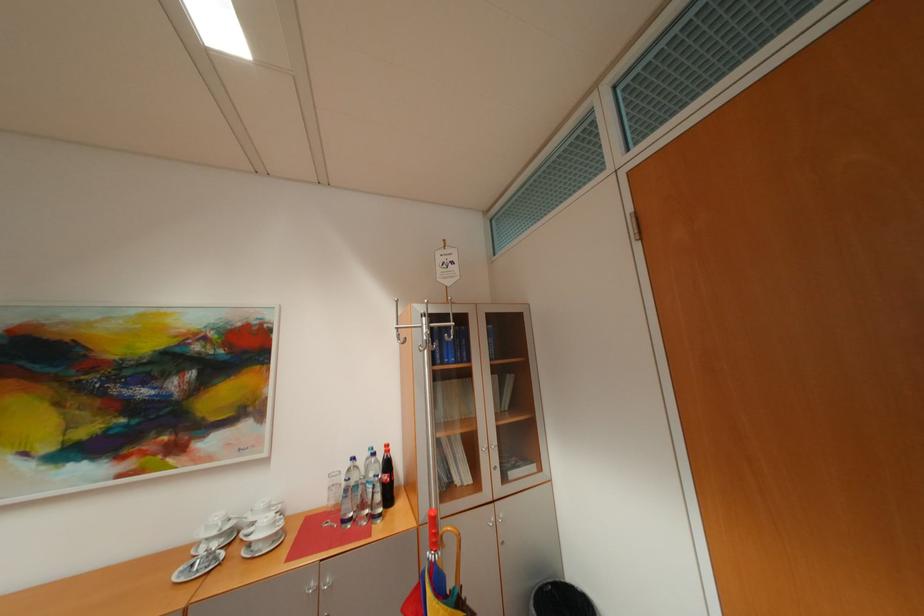
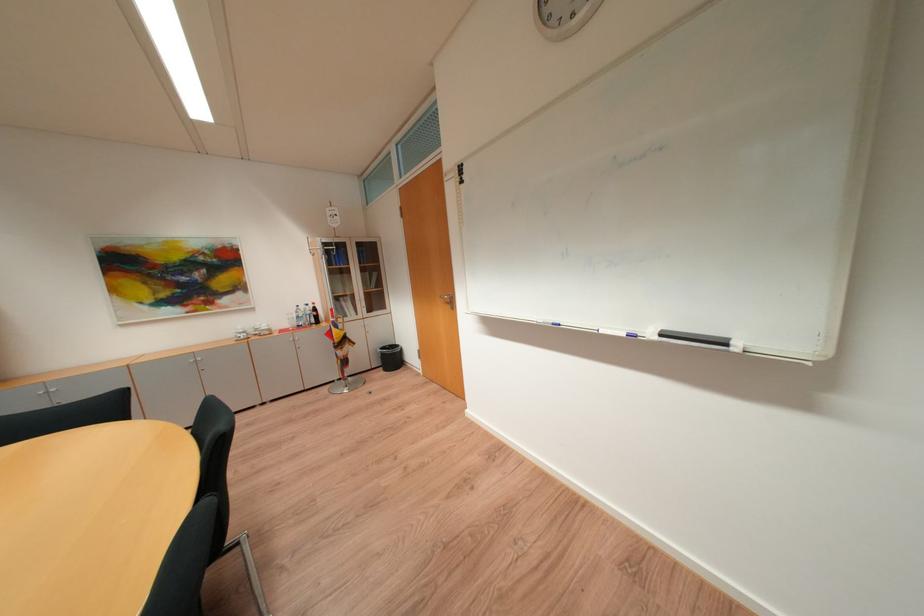
The point at (371, 461) is marked in the first image. Where is the corresponding point in the second image?

(310, 309)